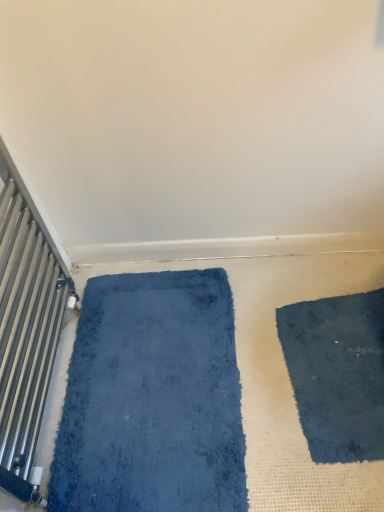
Question: Considering the positions of metallic silver radiator at left and blue plush bath mat at left in the image, is metallic silver radiator at left taller or shorter than blue plush bath mat at left?

Choices:
 (A) tall
 (B) short

Answer: (A)

Question: In terms of width, does metallic silver radiator at left look wider or thinner when compared to blue plush bath mat at left?

Choices:
 (A) thin
 (B) wide

Answer: (A)

Question: Estimate the real-world distances between objects in this image. Which object is farther from the metallic silver radiator at left?

Choices:
 (A) blue plush bath mat at left
 (B) dark blue shaggy mat at lower right

Answer: (B)

Question: Estimate the real-world distances between objects in this image. Which object is closer to the metallic silver radiator at left?

Choices:
 (A) dark blue shaggy mat at lower right
 (B) blue plush bath mat at left

Answer: (B)